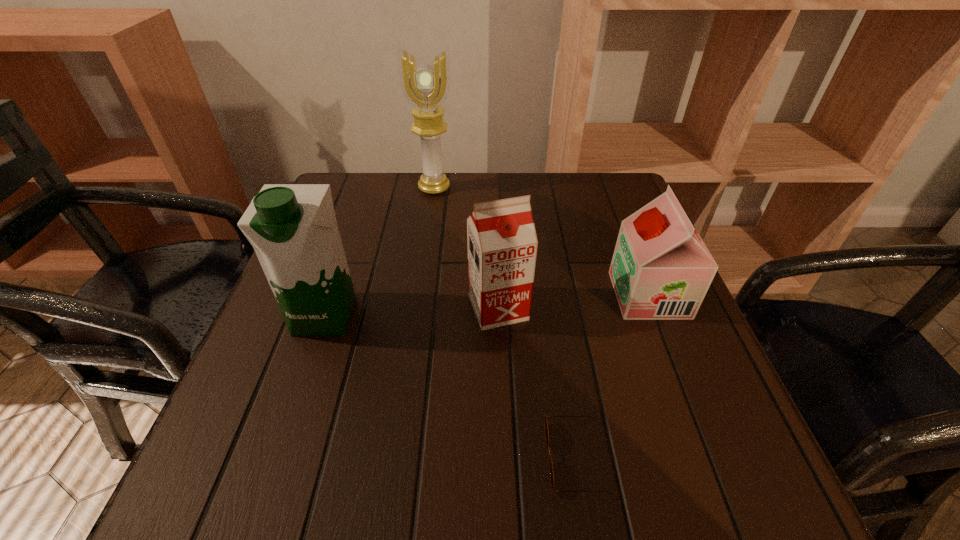
Where is `object positioned at the right edge`? Image resolution: width=960 pixels, height=540 pixels. object positioned at the right edge is located at coordinates (661, 269).

At what (x,y) coordinates should I click in order to perform the action: click on free space at the far edge of the desktop. Please return your answer as a coordinate pair (x, y). The image size is (960, 540). Looking at the image, I should click on (413, 202).

Where is `free space at the near edge`? free space at the near edge is located at coordinates (396, 477).

The width and height of the screenshot is (960, 540). Find the location of `free spot at the left edge of the desktop`. free spot at the left edge of the desktop is located at coordinates (209, 446).

In the image, there is a desktop. Where is `vacant space at the right edge`? This screenshot has width=960, height=540. vacant space at the right edge is located at coordinates (595, 267).

In the image, there is a desktop. What are the coordinates of `vacant space at the near left corner` in the screenshot? It's located at click(x=302, y=487).

The height and width of the screenshot is (540, 960). What are the coordinates of `vacant space at the far right corner` in the screenshot? It's located at (577, 192).

Identify the location of vacant area at the near right corner of the desktop. (x=741, y=467).

Locate an element on the screen. Image resolution: width=960 pixels, height=540 pixels. vacant space in between the sunglasses and the third object from right to left is located at coordinates (537, 382).

Locate an element on the screen. This screenshot has width=960, height=540. free spot between the sunglasses and the leftmost object is located at coordinates (450, 386).